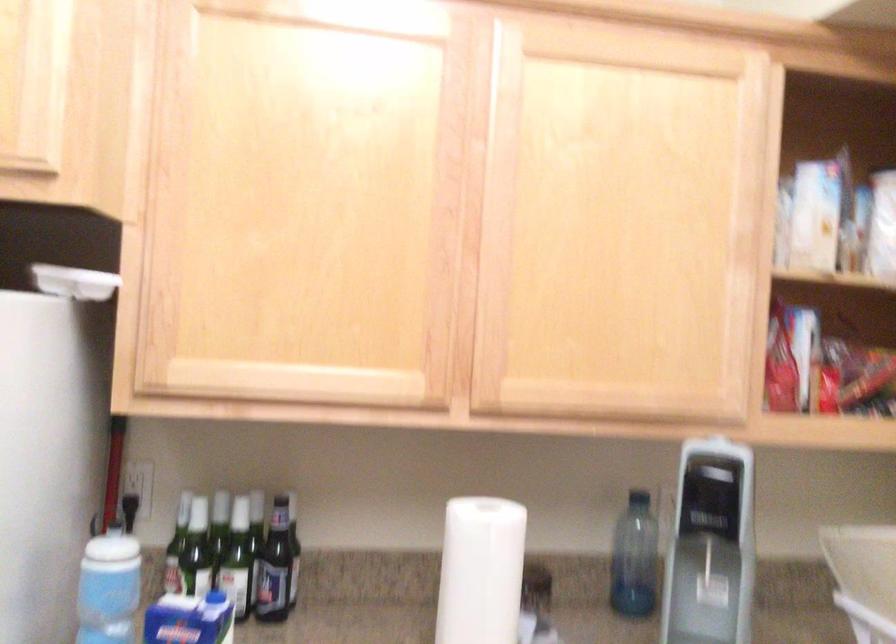
Which object does [479,571] point to?

It refers to a white paper towel roll.